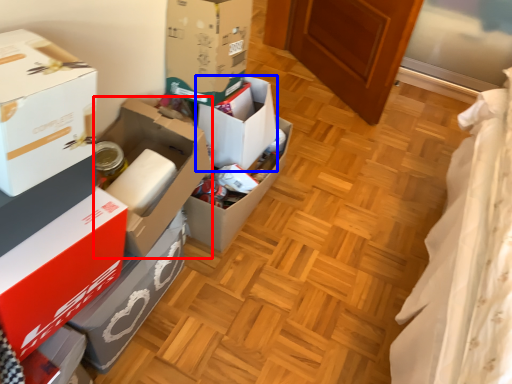
Question: Which object appears farthest to the camera in this image, box (highlighted by a red box) or box (highlighted by a blue box)?

Choices:
 (A) box
 (B) box

Answer: (B)